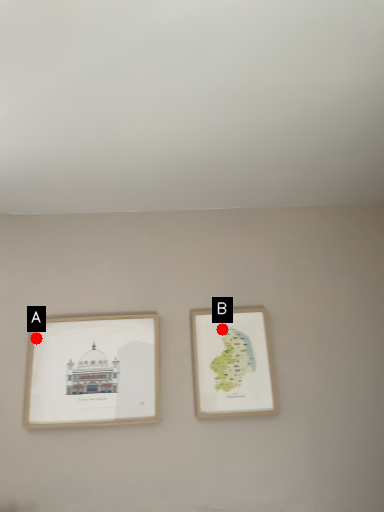
Question: Two points are circled on the image, labeled by A and B beside each circle. Which point is farther from the camera taking this photo?

Choices:
 (A) A is further
 (B) B is further

Answer: (B)